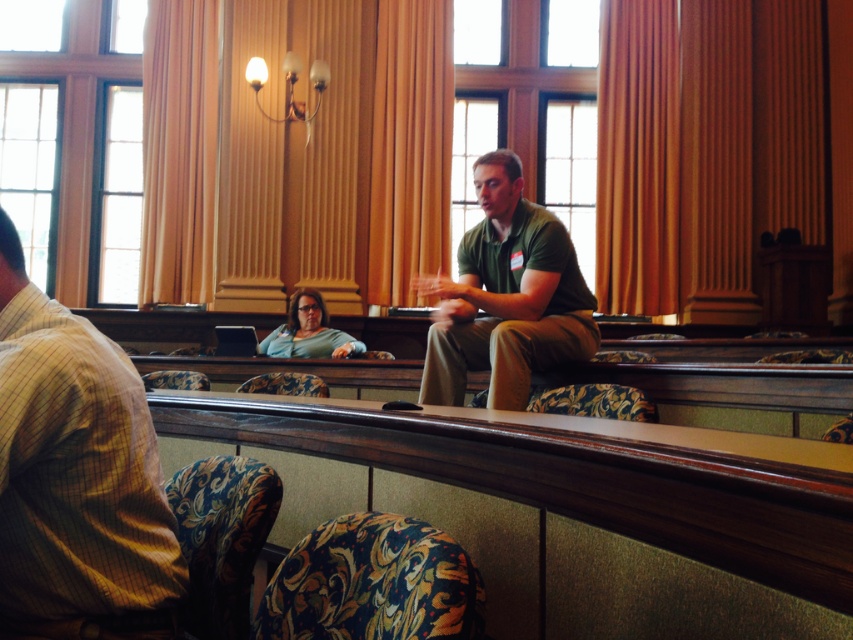
You are sitting in the audience of the lecture hall and want to see the presenter who is standing at the front. Is the wooden table at center blocking your view of the yellow striped shirt at left?

The wooden table at center is positioned under the yellow striped shirt at left, so it is below the presenter. This means the wooden table at center does not block your view of the yellow striped shirt at left since it is located beneath it.

You are an attendee in the lecture hall and want to see the presenter clearly. The presenter is wearing the green matte shirt at center. Is the wooden table at center blocking your view of the presenter?

The wooden table at center is below the green matte shirt at center, so the table is positioned lower and would not block your view of the presenter wearing the green matte shirt at center.

You are organizing a small presentation in the lecture hall and need to place a name tag for a speaker. The name tag is the size of the matte green shirt at center. Will the wooden table at center have enough space to accommodate the name tag?

The wooden table at center is bigger than the matte green shirt at center, so yes, the wooden table at center has enough space to accommodate the name tag.